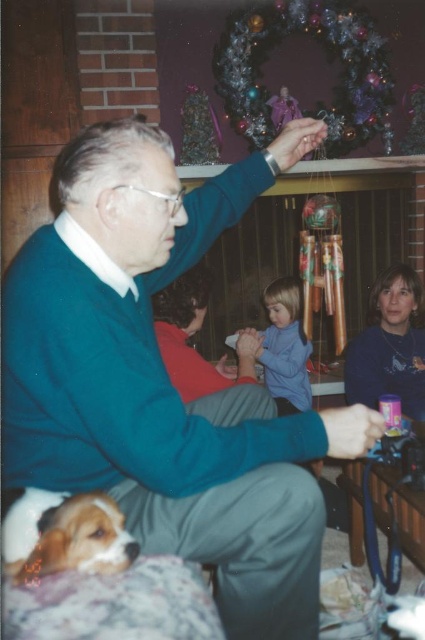
You are organizing a closet and need to decide which item takes up more space horizontally. Based on the image, which is wider, the green sweater at center or the blue smooth shirt at center?

The green sweater at center is wider than the blue smooth shirt at center, so it takes up more horizontal space.

You are a photographer setting up a shot in this living room. You want to capture both the green sweater at center and the brown fur dog at lower left in the same frame. Which object should you focus on first to ensure both are in focus?

The photographer should focus on the green sweater at center first since it is located above the brown fur dog at lower left, meaning it is closer to the camera. By focusing on the closer object, both will be in focus due to the depth of field.